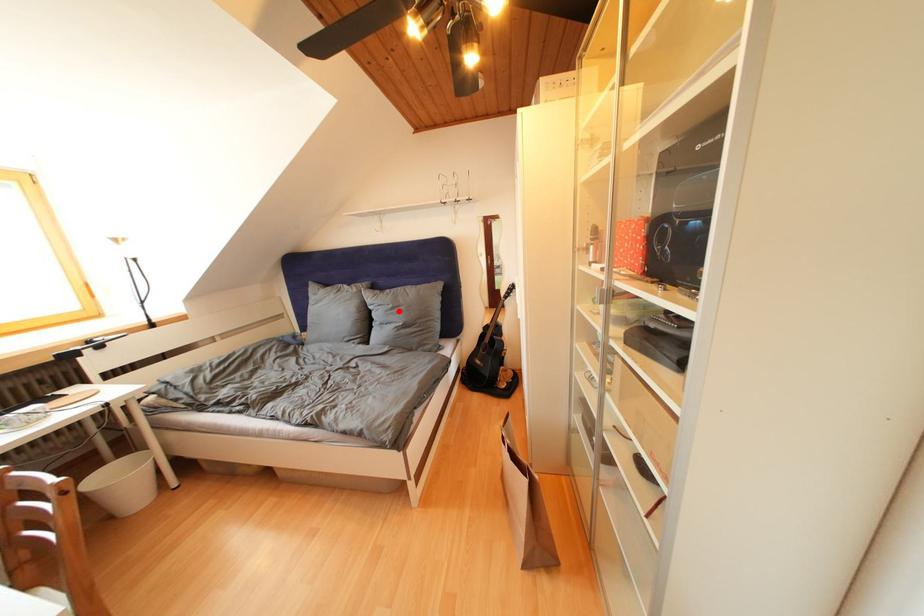
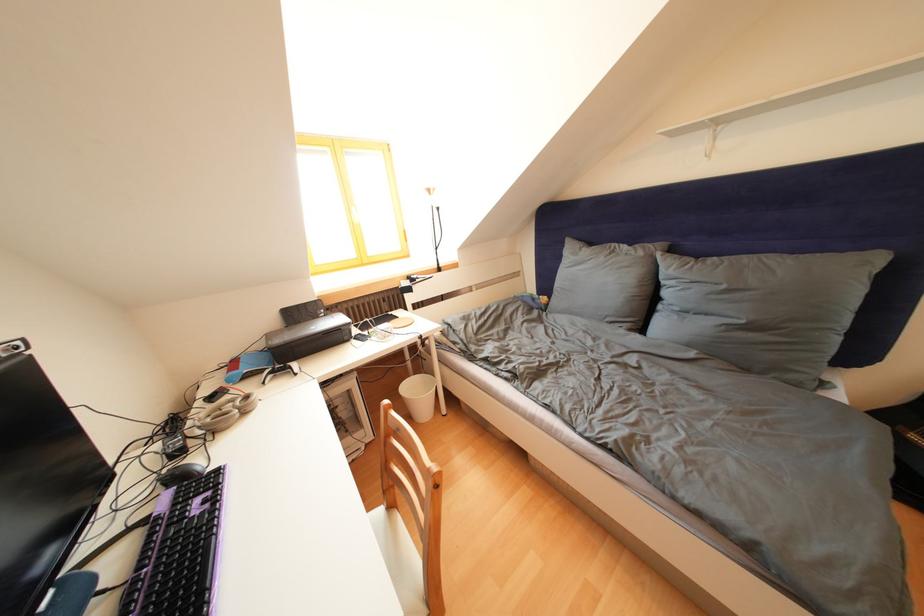
The point at the highlighted location is marked in the first image. Where is the corresponding point in the second image?

(733, 292)